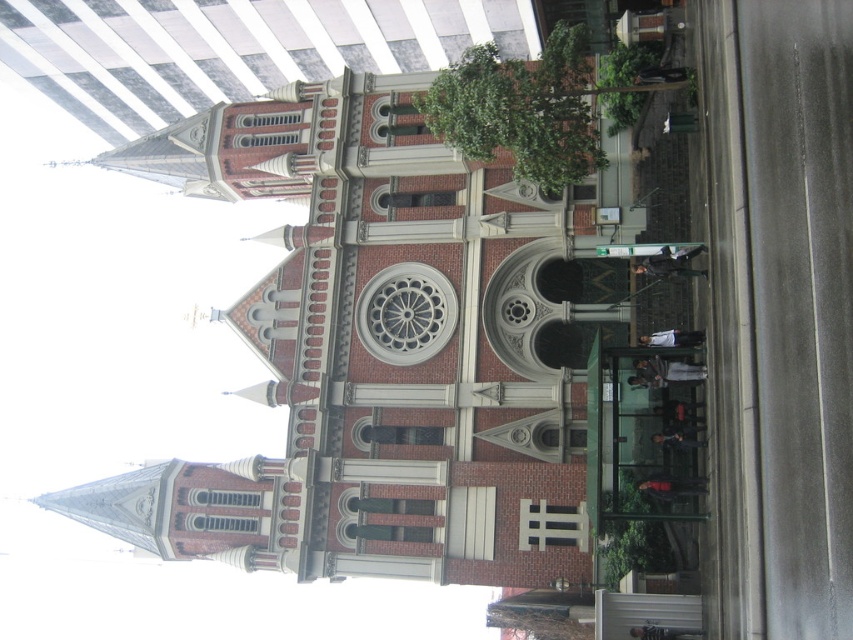
Which of these two, green leafy tree at center or green leafy plant at lower right, stands taller?

Standing taller between the two is green leafy tree at center.

Is green leafy tree at center further to the viewer compared to green leafy plant at lower right?

Yes, green leafy tree at center is behind green leafy plant at lower right.

This screenshot has height=640, width=853. Describe the element at coordinates (520, 109) in the screenshot. I see `green leafy tree at center` at that location.

Locate an element on the screen. green leafy tree at center is located at coordinates (520, 109).

Is point (410, 236) positioned after point (618, 96)?

Yes, it is.

The width and height of the screenshot is (853, 640). In order to click on red brick church at center in this screenshot , I will do `click(386, 358)`.

Identify the location of red brick church at center. Image resolution: width=853 pixels, height=640 pixels. (386, 358).

How distant is green leafy tree at center from green leafy plant at upper center?

A distance of 10.59 feet exists between green leafy tree at center and green leafy plant at upper center.

Does green leafy tree at center appear under green leafy plant at upper center?

Yes, green leafy tree at center is below green leafy plant at upper center.

What do you see at coordinates (520, 109) in the screenshot? I see `green leafy tree at center` at bounding box center [520, 109].

You are a GUI agent. You are given a task and a screenshot of the screen. Output one action in this format:
    pyautogui.click(x=<x>, y=<y>)
    Task: Click on the green leafy tree at center
    
    Given the screenshot: What is the action you would take?
    pyautogui.click(x=520, y=109)